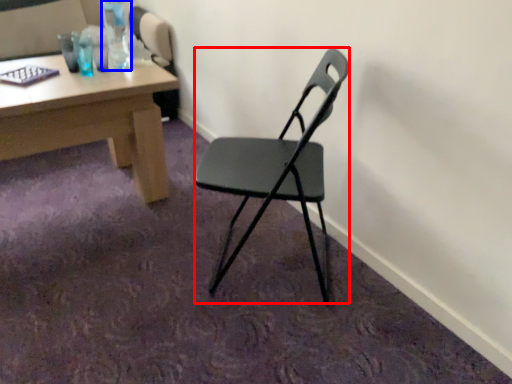
Question: Which object is further to the camera taking this photo, chair (highlighted by a red box) or bottle (highlighted by a blue box)?

Choices:
 (A) chair
 (B) bottle

Answer: (B)